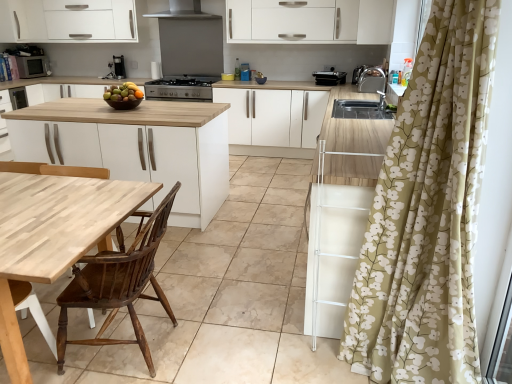
Question: From the image's perspective, relative to matte silver microwave at left, acting as the first appliance starting from the left, is wooden chair at left, acting as the 3th chair starting from the right, above or below?

Choices:
 (A) above
 (B) below

Answer: (B)

Question: Based on their positions, is wooden chair at left, the 1th chair positioned from the left, located to the left or right of matte silver microwave at left, which is the 1th appliance from back to front?

Choices:
 (A) right
 (B) left

Answer: (A)

Question: Which is nearer to the white matte cabinet at upper right, the 1th cabinetry in the right-to-left sequence?

Choices:
 (A) shiny brown bowl of mixed fruits at center
 (B) stainless steel exhaust hood at upper center
 (C) light brown wood chair at lower left, which appears as the second chair when viewed from the left
 (D) matte silver microwave at left, which ranks as the third appliance in right-to-left order
 (E) wooden chair at left, acting as the 3th chair starting from the right

Answer: (A)

Question: Which object is the farthest from the matte silver microwave at left, which ranks as the first appliance in top-to-bottom order?

Choices:
 (A) white matte cabinet at upper left, which is the 1th cabinetry from left to right
 (B) wooden chair at left, acting as the 3th chair starting from the right
 (C) wooden at left, which is counted as the first chair, starting from the right
 (D) white matte cabinet at upper right, positioned as the second cabinetry in top-to-bottom order
 (E) shiny brown bowl of mixed fruits at center

Answer: (B)